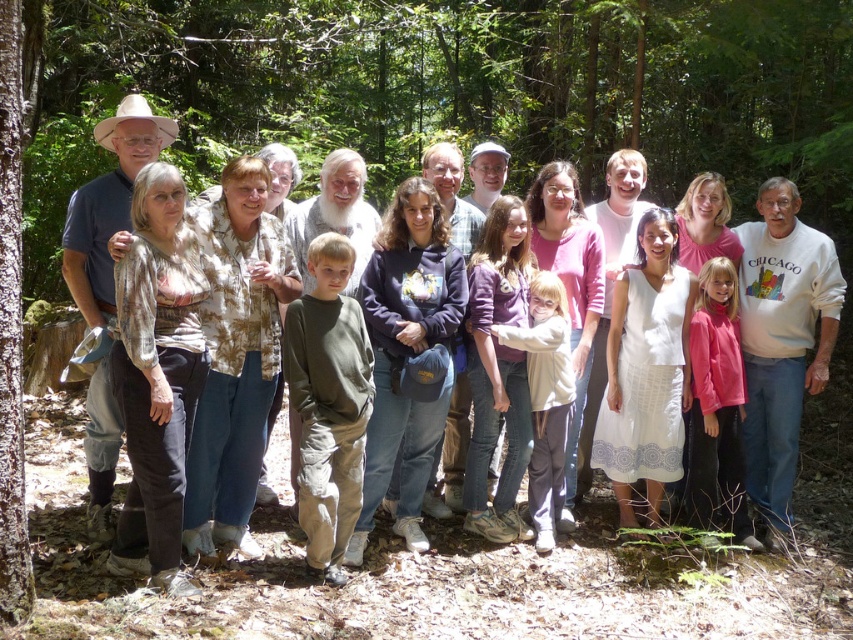
Based on the scene description, where is the white cotton sweatshirt located? Please provide coordinates in the format of a point like point (x=782, y=340).

The white cotton sweatshirt at right is located at point (x=782, y=340).

You are standing in the forest scene and need to locate both the white cotton sweatshirt at right and the matte khaki pants at center. Which object is positioned more to the east?

The white cotton sweatshirt at right is positioned to the right of the matte khaki pants at center, so if the matte khaki pants at center is at the center, the white cotton sweatshirt at right would be more to the east.

You are organizing a clothing donation drive and need to determine if the white cotton sweatshirt at right can fit into a donation box that is designed to hold items the size of the matte khaki pants at center. Based on the scene description, can the sweatshirt fit into the box?

The white cotton sweatshirt at right has a larger size compared to the matte khaki pants at center. Therefore, the sweatshirt cannot fit into the donation box designed for the size of the matte khaki pants at center.